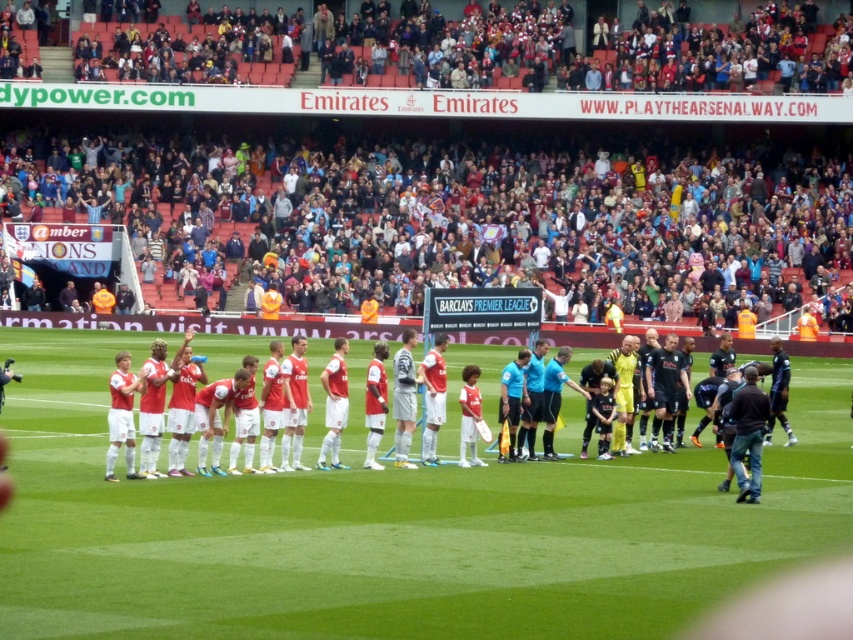
Is green grass field at center below matte red jersey at center?

Correct, green grass field at center is located below matte red jersey at center.

Can you confirm if green grass field at center is smaller than matte red jersey at center?

No, green grass field at center is not smaller than matte red jersey at center.

Where is `green grass field at center`? green grass field at center is located at coordinates (392, 524).

At what (x,y) coordinates should I click in order to perform the action: click on green grass field at center. Please return your answer as a coordinate pair (x, y). This screenshot has width=853, height=640. Looking at the image, I should click on (392, 524).